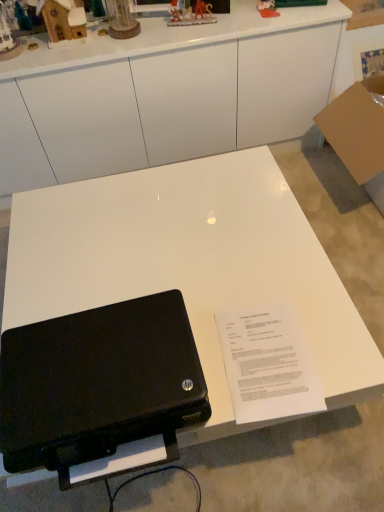
You are a GUI agent. You are given a task and a screenshot of the screen. Output one action in this format:
    pyautogui.click(x=<x>, y=<y>)
    Task: Click on the free spot above black matte laptop at lower left (from a real-world perspective)
    The image size is (384, 512).
    Given the screenshot: What is the action you would take?
    pyautogui.click(x=98, y=369)